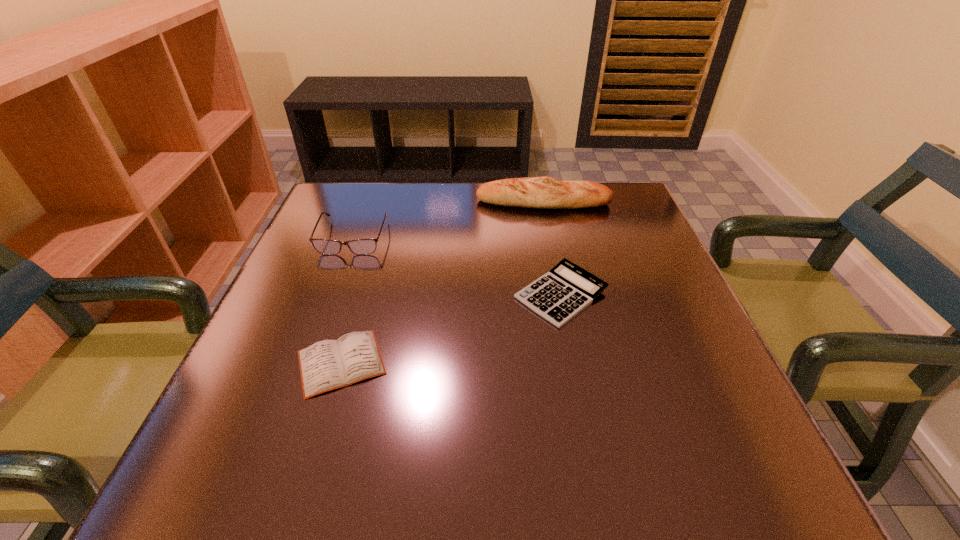
Find the location of a particular element. the tallest object is located at coordinates (545, 192).

Image resolution: width=960 pixels, height=540 pixels. In order to click on the farthest object in this screenshot , I will do `click(545, 192)`.

At what (x,y) coordinates should I click in order to perform the action: click on the second farthest object. Please return your answer as a coordinate pair (x, y). The image size is (960, 540). Looking at the image, I should click on (323, 246).

Identify the location of the third shortest object. (323, 246).

What are the coordinates of `calculator` in the screenshot? It's located at (560, 294).

This screenshot has width=960, height=540. Find the location of `the third farthest object`. the third farthest object is located at coordinates (560, 294).

I want to click on the shortest object, so click(x=326, y=365).

Identify the location of the nearest object. (326, 365).

This screenshot has height=540, width=960. What are the coordinates of `vacant region located on the left of the tallest object` in the screenshot? It's located at (372, 202).

Find the location of a particular element. Image resolution: width=960 pixels, height=540 pixels. blank area located 0.380m on the lenses of the spectacles is located at coordinates (291, 407).